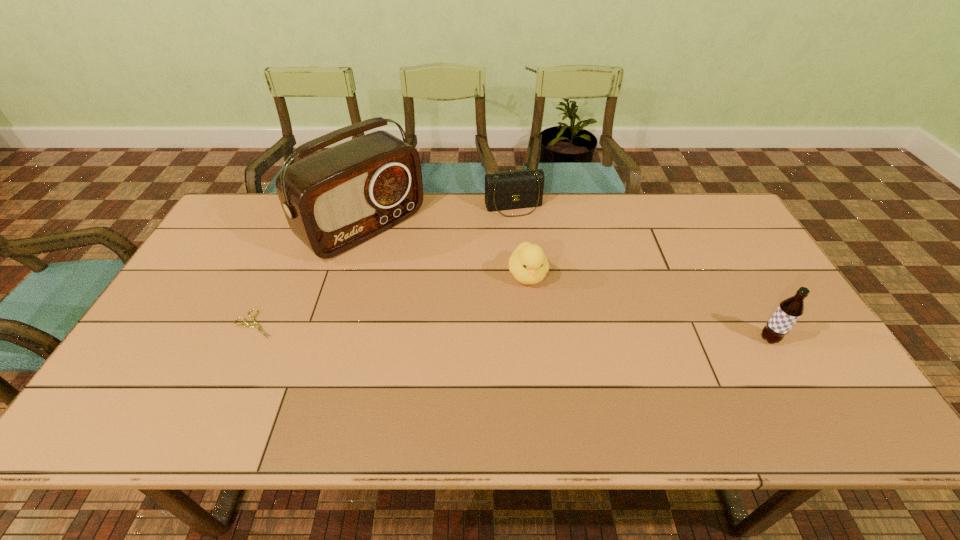
Find the location of `vacant space that satisfies the following two spatial constraints: 1. on the back side of the shears; 2. on the right side of the radio receiver`. vacant space that satisfies the following two spatial constraints: 1. on the back side of the shears; 2. on the right side of the radio receiver is located at coordinates (300, 227).